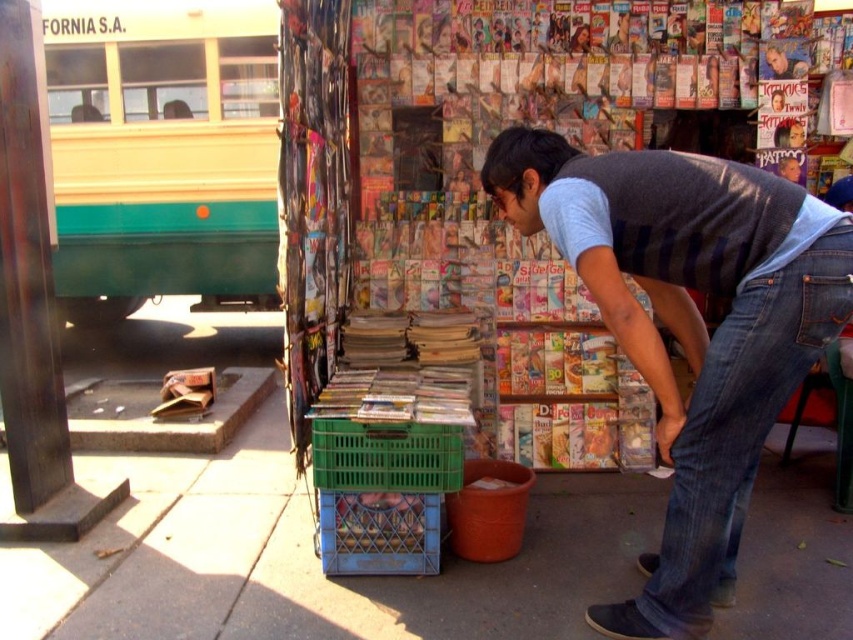
You are a customer trying to place a small wallet between the denim at lower right and the green plastic crate at lower center. Based on the scene description, will the wallet fit between them?

The denim at lower right is thinner than the green plastic crate at lower center, so the wallet may fit between them if the space between their thickness allows.

You are a delivery person who needs to park your 2.5 meter wide delivery truck on the street. The truck requires a space at least as wide as the smooth concrete pavement at center. Can you park your truck in the space where the teal matte bus at left is currently parked?

The smooth concrete pavement at center is bigger than the teal matte bus at left. Since the truck requires a space at least as wide as the smooth concrete pavement at center, it cannot park in the space where the teal matte bus at left is parked because that space is smaller.